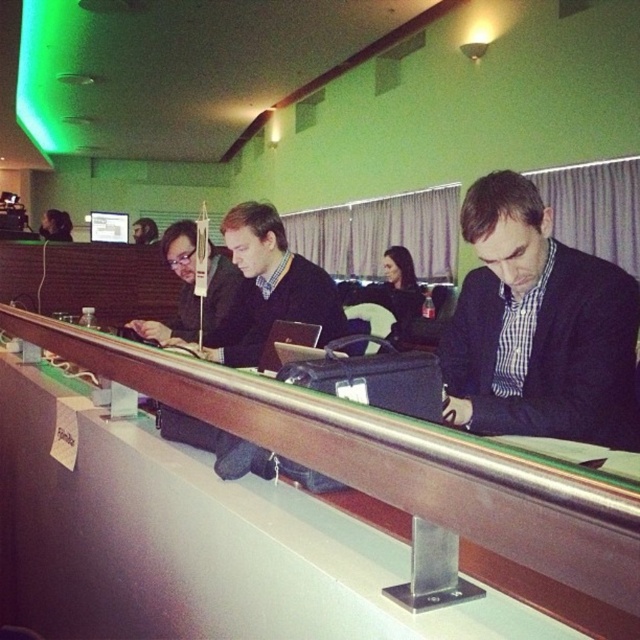
Does point (468, 483) lie behind point (412, 269)?

No, (468, 483) is in front of (412, 269).

Can you confirm if wooden table at center is positioned above black fabric jacket at center?

Actually, wooden table at center is below black fabric jacket at center.

Which is in front, point (422, 492) or point (406, 317)?

Point (422, 492) is in front.

Image resolution: width=640 pixels, height=640 pixels. Identify the location of wooden table at center. (376, 451).

Is black matte suit at center to the right of wooden table at center from the viewer's perspective?

Correct, you'll find black matte suit at center to the right of wooden table at center.

Who is shorter, black matte suit at center or wooden table at center?

With less height is wooden table at center.

Who is more forward, [611,284] or [440,449]?

Positioned in front is point [440,449].

At what (x,y) coordinates should I click in order to perform the action: click on black matte suit at center. Please return your answer as a coordinate pair (x, y). The image size is (640, 640). Looking at the image, I should click on coord(538,326).

Is black matte suit at center below black fabric jacket at center?

Indeed, black matte suit at center is positioned under black fabric jacket at center.

Does black matte suit at center have a larger size compared to black fabric jacket at center?

Actually, black matte suit at center might be smaller than black fabric jacket at center.

What do you see at coordinates (538, 326) in the screenshot?
I see `black matte suit at center` at bounding box center [538, 326].

Locate an element on the screen. This screenshot has width=640, height=640. black matte suit at center is located at coordinates (538, 326).